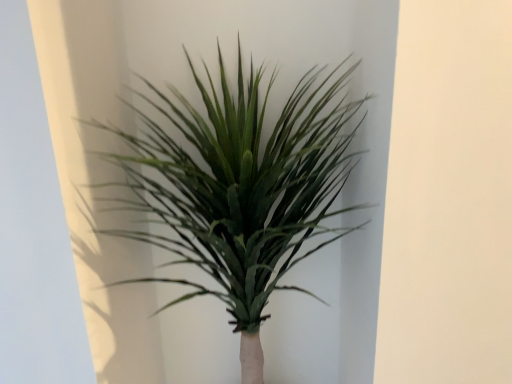
Image resolution: width=512 pixels, height=384 pixels. Identify the location of green matte plant at center. (241, 188).

What do you see at coordinates (241, 188) in the screenshot? The width and height of the screenshot is (512, 384). I see `green matte plant at center` at bounding box center [241, 188].

What is the approximate width of green matte plant at center?

16.31 inches.

Image resolution: width=512 pixels, height=384 pixels. Find the location of `green matte plant at center`. green matte plant at center is located at coordinates (241, 188).